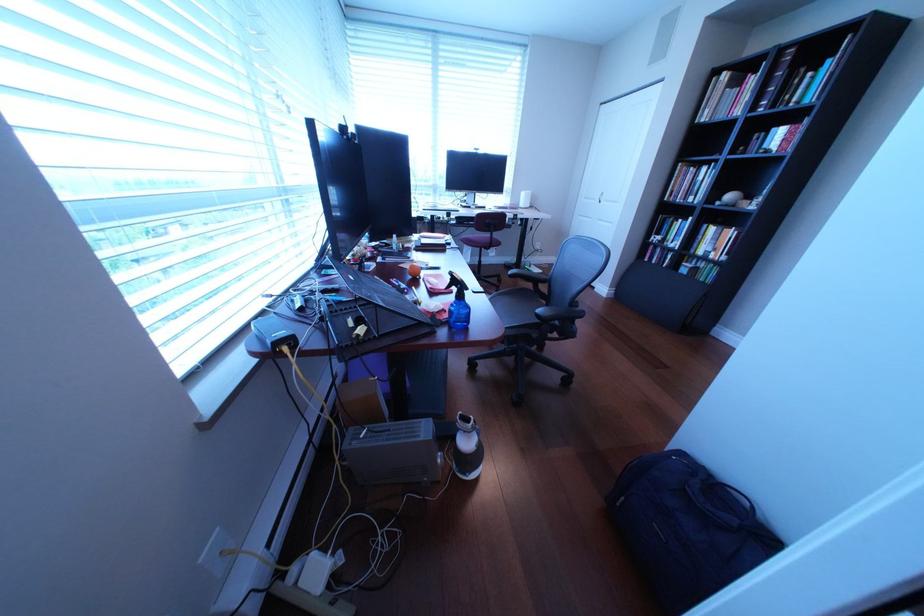
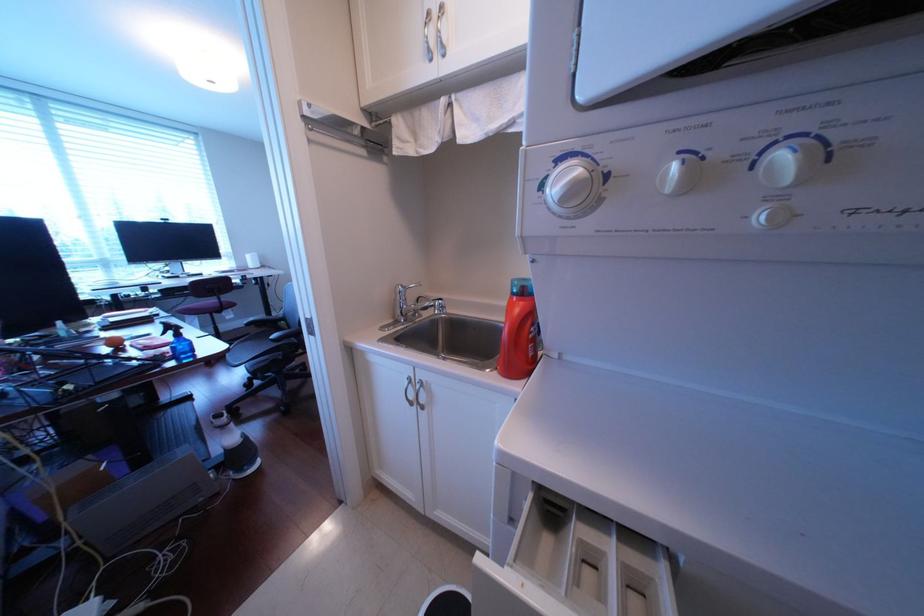
Question: The camera is either moving clockwise (left) or counter-clockwise (right) around the object. The first image is from the beginning of the video and the second image is from the end. Is the camera moving left or right when shooting the video?

Choices:
 (A) Left
 (B) Right

Answer: (A)